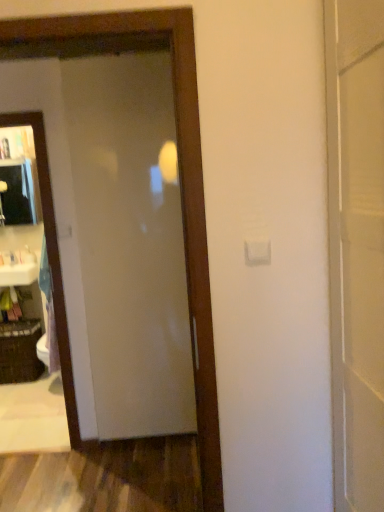
Locate an element on the screen. This screenshot has width=384, height=512. blank space above matte black medicine cabinet at left (from a real-world perspective) is located at coordinates coord(15,158).